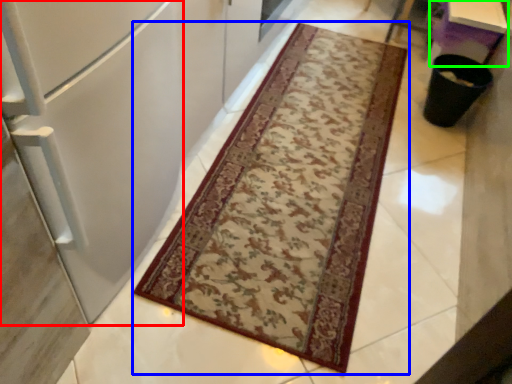
Question: Which is nearer to the fridge (highlighted by a red box)? mat (highlighted by a blue box) or table (highlighted by a green box).

Choices:
 (A) mat
 (B) table

Answer: (A)